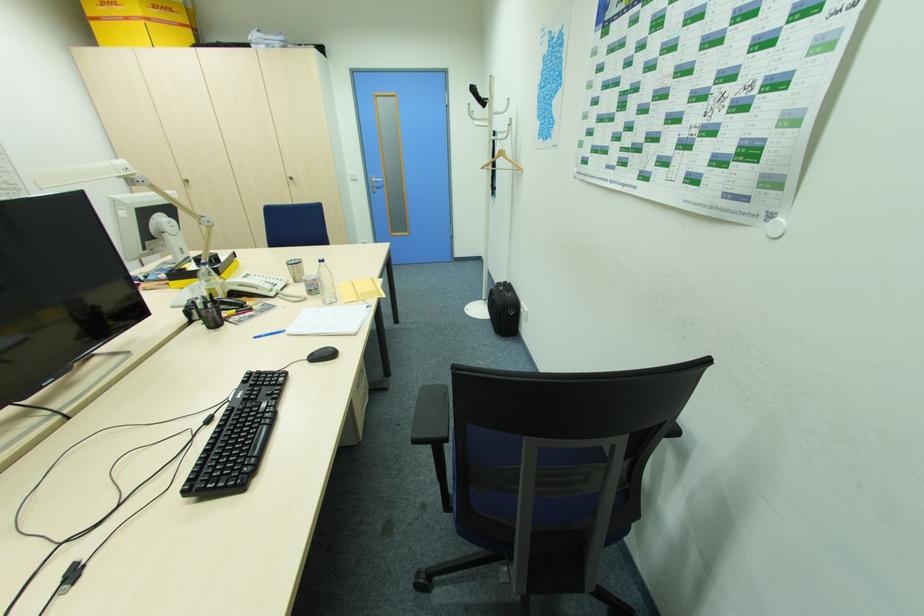
Where would you pull the metal door handle? Please return your answer as a coordinate pair (x, y).

(377, 179)